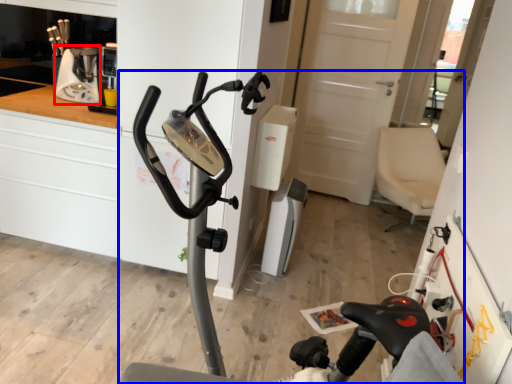
Question: Which point is closer to the camera, coffee machine (highlighted by a red box) or stationary bicycle (highlighted by a blue box)?

Choices:
 (A) coffee machine
 (B) stationary bicycle

Answer: (B)